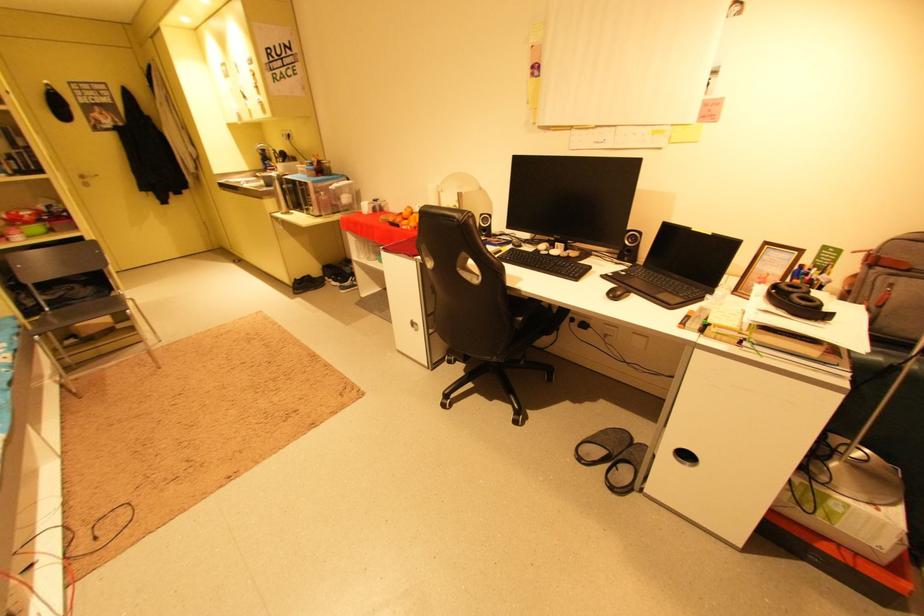
Locate an element on the screen. Image resolution: width=924 pixels, height=616 pixels. silver door handle is located at coordinates (86, 177).